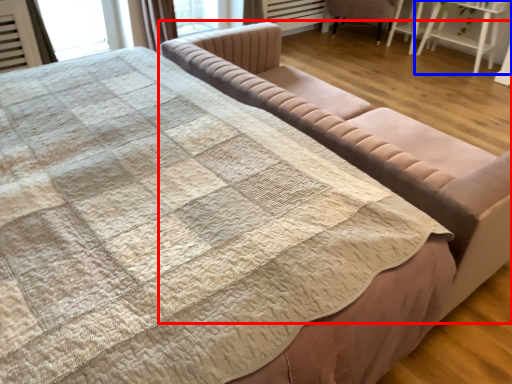
Question: Which object is closer to the camera taking this photo, studio couch (highlighted by a red box) or table (highlighted by a blue box)?

Choices:
 (A) studio couch
 (B) table

Answer: (A)